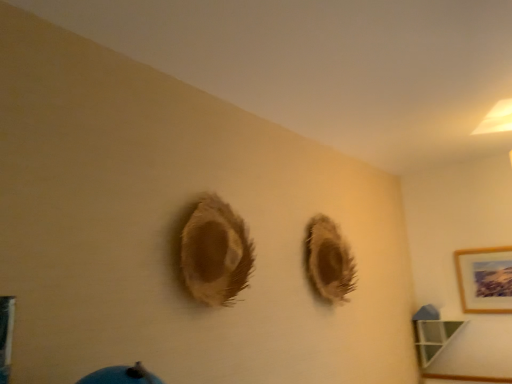
Question: Does green glass shelf at lower right come behind wooden picture frame at upper right?

Choices:
 (A) no
 (B) yes

Answer: (B)

Question: Can you confirm if green glass shelf at lower right is positioned to the left of wooden picture frame at upper right?

Choices:
 (A) no
 (B) yes

Answer: (B)

Question: From a real-world perspective, is green glass shelf at lower right positioned under wooden picture frame at upper right based on gravity?

Choices:
 (A) no
 (B) yes

Answer: (B)

Question: Is green glass shelf at lower right shorter than wooden picture frame at upper right?

Choices:
 (A) no
 (B) yes

Answer: (B)

Question: Can wooden picture frame at upper right be found inside green glass shelf at lower right?

Choices:
 (A) yes
 (B) no

Answer: (B)

Question: Looking at their shapes, would you say fuzzy brown hole at center is wider or thinner than green glass shelf at lower right?

Choices:
 (A) wide
 (B) thin

Answer: (B)

Question: From the image's perspective, relative to green glass shelf at lower right, is fuzzy brown hole at center above or below?

Choices:
 (A) above
 (B) below

Answer: (A)

Question: Choose the correct answer: Is fuzzy brown hole at center inside green glass shelf at lower right or outside it?

Choices:
 (A) inside
 (B) outside

Answer: (B)

Question: Is fuzzy brown hole at center in front of or behind green glass shelf at lower right in the image?

Choices:
 (A) front
 (B) behind

Answer: (A)

Question: From the image's perspective, is wooden picture frame at upper right above or below green glass shelf at lower right?

Choices:
 (A) below
 (B) above

Answer: (B)

Question: In the image, is wooden picture frame at upper right on the left side or the right side of green glass shelf at lower right?

Choices:
 (A) right
 (B) left

Answer: (A)

Question: Considering their positions, is wooden picture frame at upper right located in front of or behind green glass shelf at lower right?

Choices:
 (A) front
 (B) behind

Answer: (A)

Question: Is wooden picture frame at upper right taller or shorter than green glass shelf at lower right?

Choices:
 (A) short
 (B) tall

Answer: (B)

Question: Would you say green glass shelf at lower right is inside or outside wooden picture frame at upper right?

Choices:
 (A) outside
 (B) inside

Answer: (A)

Question: Is green glass shelf at lower right taller or shorter than wooden picture frame at upper right?

Choices:
 (A) tall
 (B) short

Answer: (B)